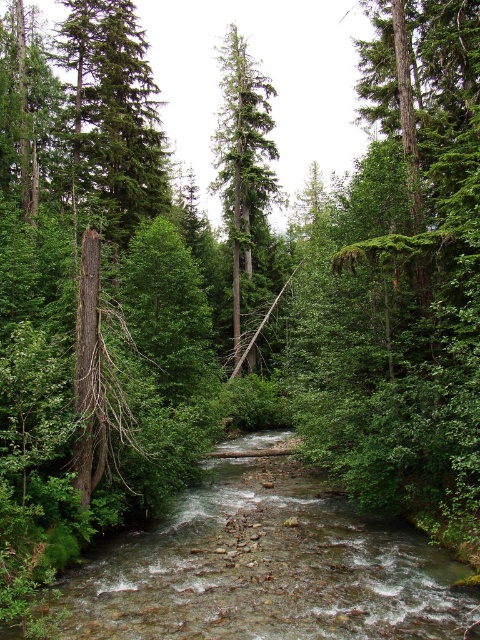
From the picture: Who is lower down, green matte tree at left or green matte tree at center?

green matte tree at left is below.

Is green matte tree at left positioned at the back of green matte tree at center?

No, it is not.

Locate an element on the screen. green matte tree at left is located at coordinates (113, 115).

Based on the photo, which is below, clear water at stream center or green matte tree at left?

clear water at stream center is below.

Which is above, clear water at stream center or green matte tree at left?

green matte tree at left is above.

What do you see at coordinates (267, 570) in the screenshot? The height and width of the screenshot is (640, 480). I see `clear water at stream center` at bounding box center [267, 570].

You are a GUI agent. You are given a task and a screenshot of the screen. Output one action in this format:
    pyautogui.click(x=<x>, y=<y>)
    Task: Click on the clear water at stream center
    
    Given the screenshot: What is the action you would take?
    pyautogui.click(x=267, y=570)

Does point (319, 566) lie in front of point (240, 243)?

Yes, it is in front of point (240, 243).

Can you confirm if clear water at stream center is thinner than green matte tree at center?

Yes, clear water at stream center is thinner than green matte tree at center.

Consider the image. Measure the distance between point (235, 508) and camera.

Point (235, 508) is 13.69 meters from camera.

I want to click on clear water at stream center, so click(267, 570).